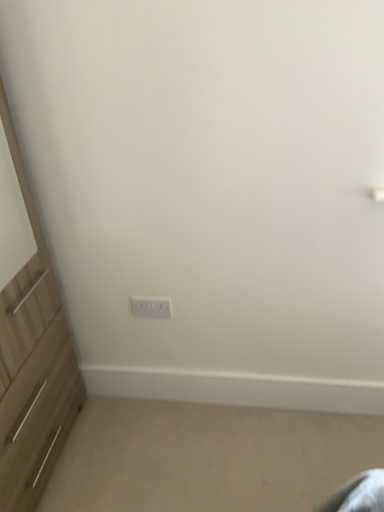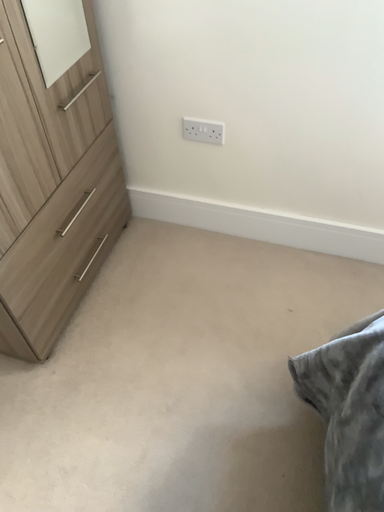
Question: Which way did the camera rotate in the video?

Choices:
 (A) rotated right
 (B) rotated left

Answer: (B)